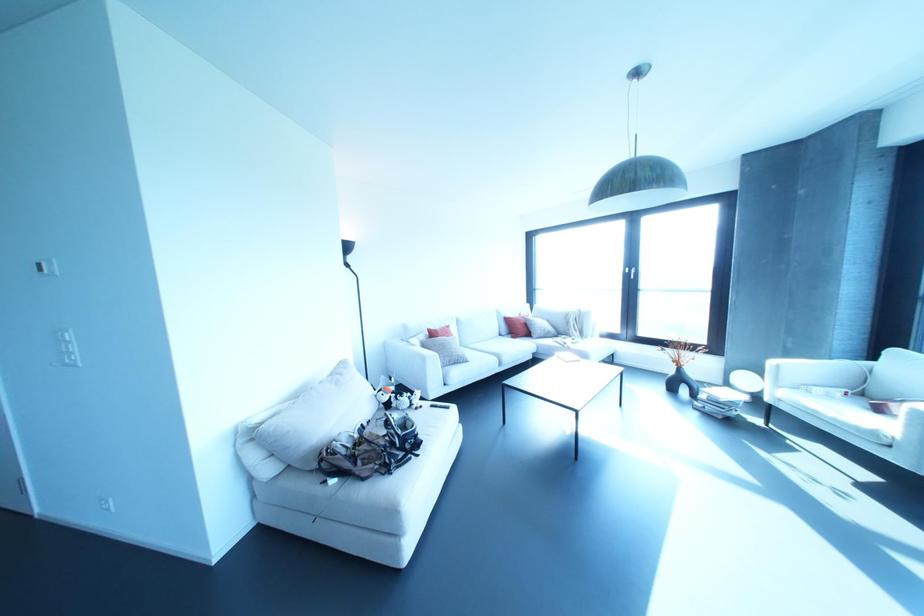
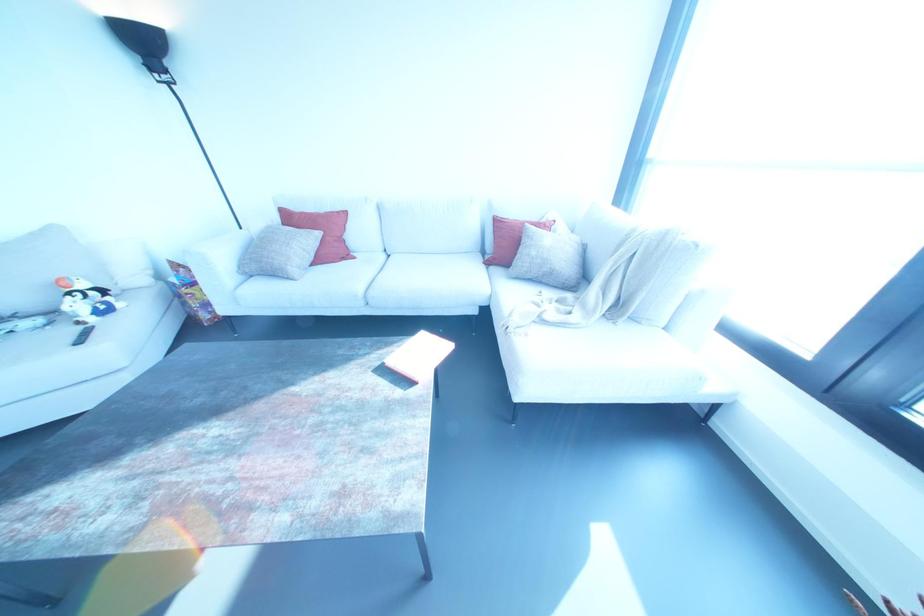
In the second image, find the point that corresponds to (x=416, y=408) in the first image.

(78, 322)